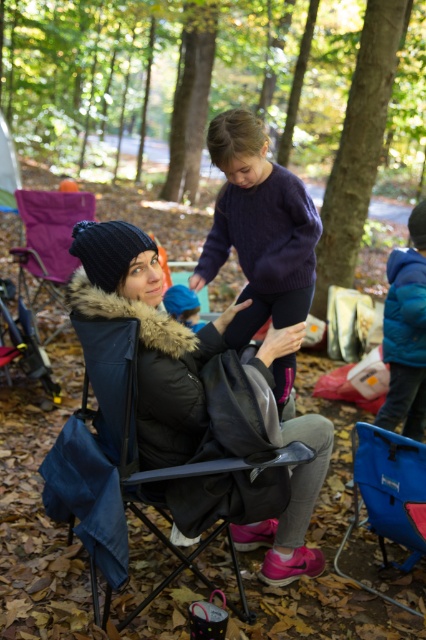
Question: Which object appears farthest from the camera in this image?

Choices:
 (A) purple knitted sweater at upper center
 (B) matte black chair at left
 (C) blue fleece jacket at right

Answer: (B)

Question: Is black fuzzy jacket at center to the right of blue fabric folding chair at lower right from the viewer's perspective?

Choices:
 (A) no
 (B) yes

Answer: (A)

Question: Is blue fleece jacket at right smaller than matte black chair at left?

Choices:
 (A) yes
 (B) no

Answer: (A)

Question: Can you confirm if blue fabric folding chair at lower right is positioned above matte black chair at left?

Choices:
 (A) no
 (B) yes

Answer: (A)

Question: Considering the real-world distances, which object is farthest from the blue fleece jacket at right?

Choices:
 (A) matte black chair at left
 (B) black fuzzy jacket at center
 (C) blue fabric folding chair at lower right
 (D) purple knitted sweater at upper center

Answer: (A)

Question: Which of the following is the farthest from the observer?

Choices:
 (A) (256, 248)
 (B) (17, 248)
 (C) (408, 442)
 (D) (196, 392)

Answer: (B)